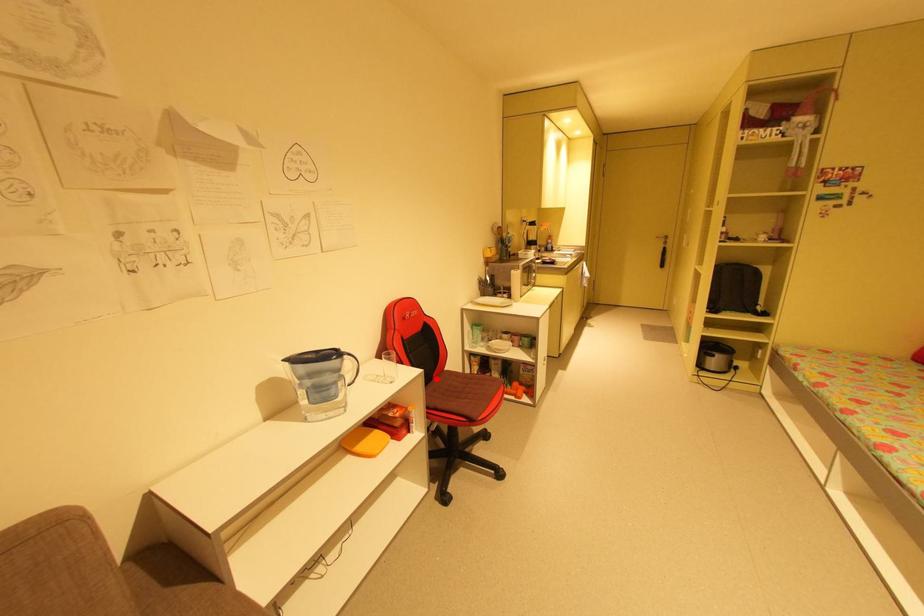
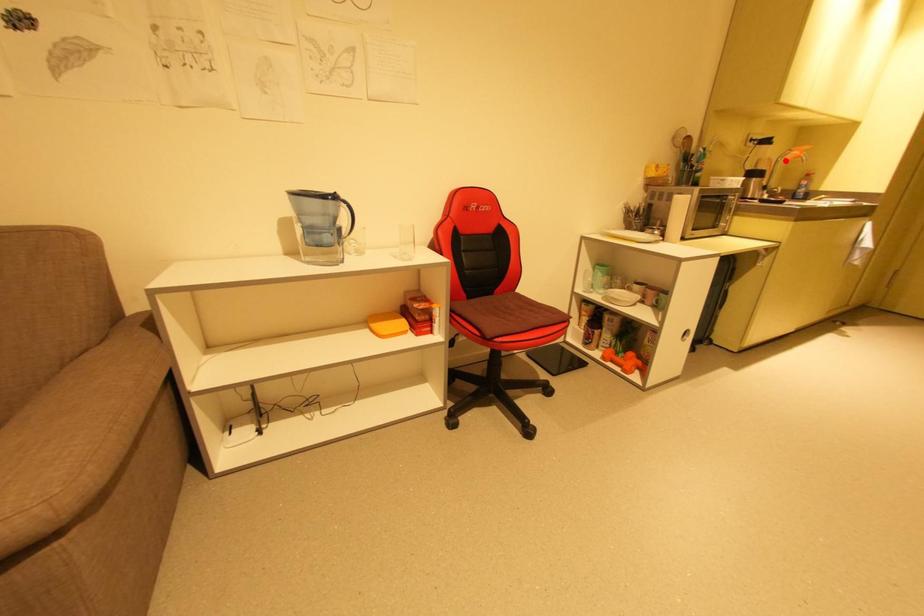
I am providing you with two images of the same scene from different viewpoints. A red point is marked on the first image and another point is marked on the second image. Does the point marked in image1 correspond to the same location as the one in image2?

No